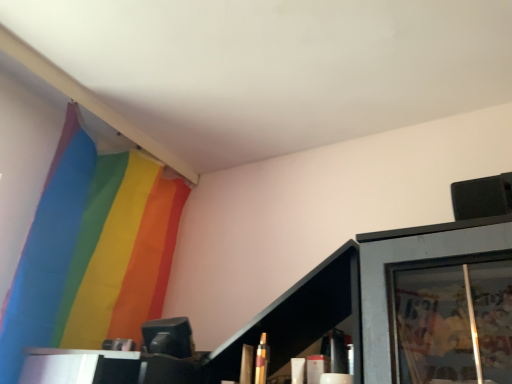
Measure the distance between point (264, 312) and camera.

The distance of point (264, 312) from camera is 1.14 meters.

Describe the element at coordinates (298, 317) in the screenshot. I see `matte black cabinet at lower right` at that location.

Find the location of a particular element. This screenshot has width=512, height=384. matte black cabinet at lower right is located at coordinates (298, 317).

Where is `rainbow fabric flag at upper left`? The width and height of the screenshot is (512, 384). rainbow fabric flag at upper left is located at coordinates (92, 251).

What do you see at coordinates (92, 251) in the screenshot?
I see `rainbow fabric flag at upper left` at bounding box center [92, 251].

The width and height of the screenshot is (512, 384). Identify the location of matte black cabinet at lower right. (298, 317).

Does rainbow fabric flag at upper left appear on the left side of matte black cabinet at lower right?

Yes, rainbow fabric flag at upper left is to the left of matte black cabinet at lower right.

Is the position of rainbow fabric flag at upper left less distant than that of matte black cabinet at lower right?

No, rainbow fabric flag at upper left is behind matte black cabinet at lower right.

Is point (139, 330) farther from camera compared to point (335, 259)?

Yes, point (139, 330) is farther from viewer.

From the image's perspective, which one is positioned lower, rainbow fabric flag at upper left or matte black cabinet at lower right?

From the image's view, matte black cabinet at lower right is below.

From a real-world perspective, does rainbow fabric flag at upper left stand above matte black cabinet at lower right?

Indeed, from a real-world perspective, rainbow fabric flag at upper left stands above matte black cabinet at lower right.

Does rainbow fabric flag at upper left have a lesser width compared to matte black cabinet at lower right?

Yes, rainbow fabric flag at upper left is thinner than matte black cabinet at lower right.

Is rainbow fabric flag at upper left taller than matte black cabinet at lower right?

Yes, rainbow fabric flag at upper left is taller than matte black cabinet at lower right.

Can you confirm if rainbow fabric flag at upper left is smaller than matte black cabinet at lower right?

Actually, rainbow fabric flag at upper left might be larger than matte black cabinet at lower right.

Is matte black cabinet at lower right inside rainbow fabric flag at upper left?

No, matte black cabinet at lower right is not a part of rainbow fabric flag at upper left.

Is rainbow fabric flag at upper left placed right next to matte black cabinet at lower right?

No.

Is rainbow fabric flag at upper left facing away from matte black cabinet at lower right?

No, rainbow fabric flag at upper left is not facing away from matte black cabinet at lower right.

Measure the distance between rainbow fabric flag at upper left and matte black cabinet at lower right.

rainbow fabric flag at upper left is 27.04 inches away from matte black cabinet at lower right.

Find the location of a particular element. The height and width of the screenshot is (384, 512). curtain above the matte black cabinet at lower right (from a real-world perspective) is located at coordinates click(92, 251).

Can you confirm if matte black cabinet at lower right is positioned to the right of rainbow fabric flag at upper left?

Yes.

Relative to rainbow fabric flag at upper left, is matte black cabinet at lower right in front or behind?

In the image, matte black cabinet at lower right appears in front of rainbow fabric flag at upper left.

Is point (343, 288) closer to viewer compared to point (32, 247)?

That is True.

From the image's perspective, is matte black cabinet at lower right located above rainbow fabric flag at upper left?

No, from the image's perspective, matte black cabinet at lower right is not over rainbow fabric flag at upper left.

From a real-world perspective, is matte black cabinet at lower right positioned over rainbow fabric flag at upper left based on gravity?

Actually, matte black cabinet at lower right is physically below rainbow fabric flag at upper left in the real world.

Looking at their sizes, would you say matte black cabinet at lower right is wider or thinner than rainbow fabric flag at upper left?

Considering their sizes, matte black cabinet at lower right looks broader than rainbow fabric flag at upper left.

Considering the sizes of objects matte black cabinet at lower right and rainbow fabric flag at upper left in the image provided, who is shorter, matte black cabinet at lower right or rainbow fabric flag at upper left?

matte black cabinet at lower right is shorter.

Is matte black cabinet at lower right bigger than rainbow fabric flag at upper left?

Actually, matte black cabinet at lower right might be smaller than rainbow fabric flag at upper left.

Is matte black cabinet at lower right positioned beyond the bounds of rainbow fabric flag at upper left?

matte black cabinet at lower right lies outside rainbow fabric flag at upper left's area.

Are matte black cabinet at lower right and rainbow fabric flag at upper left located far from each other?

No.

Is matte black cabinet at lower right turned away from rainbow fabric flag at upper left?

No, rainbow fabric flag at upper left is not at the back of matte black cabinet at lower right.

Measure the distance from matte black cabinet at lower right to rainbow fabric flag at upper left.

The distance of matte black cabinet at lower right from rainbow fabric flag at upper left is 68.69 centimeters.

The height and width of the screenshot is (384, 512). What are the coordinates of `curtain lying above the matte black cabinet at lower right (from the image's perspective)` in the screenshot? It's located at (92, 251).

This screenshot has height=384, width=512. I want to click on curtain to the left of matte black cabinet at lower right, so click(92, 251).

At what (x,y) coordinates should I click in order to perform the action: click on cabinet below the rainbow fabric flag at upper left (from a real-world perspective). Please return your answer as a coordinate pair (x, y). Image resolution: width=512 pixels, height=384 pixels. Looking at the image, I should click on (298, 317).